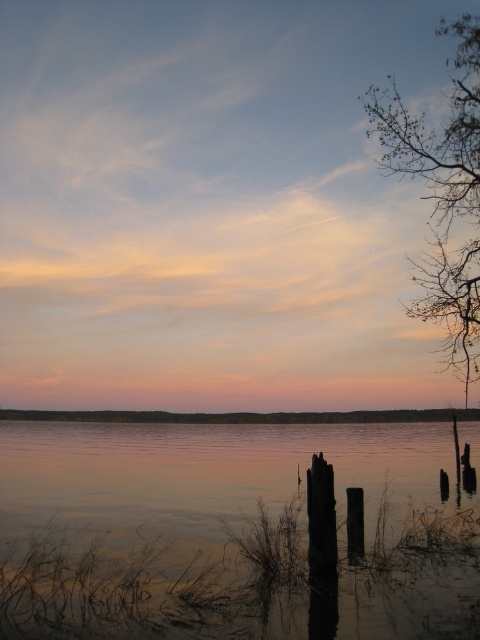
Question: In this image, where is smooth reflective water at center located relative to bare branches at upper right?

Choices:
 (A) below
 (B) above

Answer: (A)

Question: Which of the following is the farthest from the observer?

Choices:
 (A) smooth reflective water at center
 (B) bare branches at upper right

Answer: (B)

Question: Is smooth reflective water at center bigger than bare branches at upper right?

Choices:
 (A) yes
 (B) no

Answer: (A)

Question: Is smooth reflective water at center to the left of bare branches at upper right from the viewer's perspective?

Choices:
 (A) no
 (B) yes

Answer: (B)

Question: Which of the following is the farthest from the observer?

Choices:
 (A) (36, 634)
 (B) (468, 301)

Answer: (B)